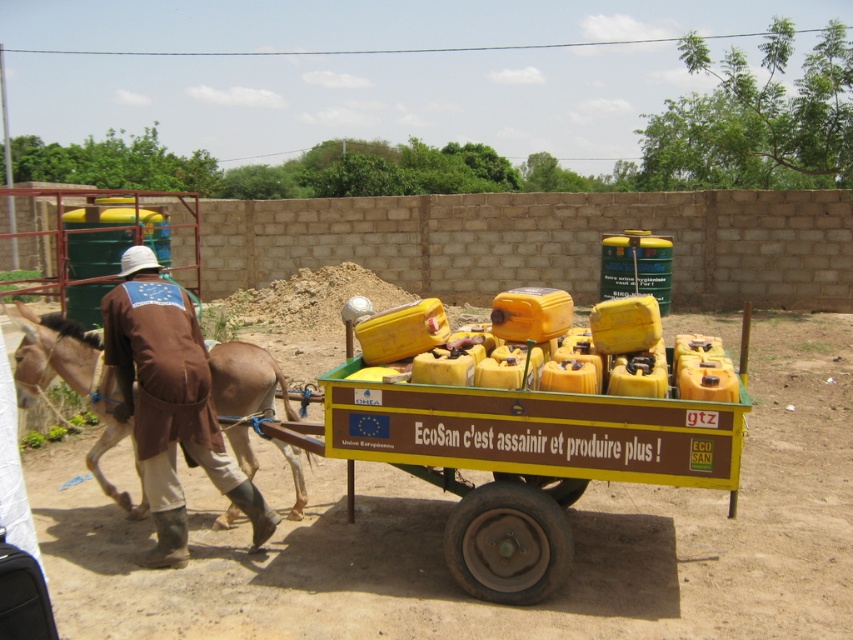
Which is more to the left, brown fabric jacket at left or brown leather mule at left?

From the viewer's perspective, brown leather mule at left appears more on the left side.

Between brown fabric jacket at left and brown leather mule at left, which one has less height?

Standing shorter between the two is brown leather mule at left.

Image resolution: width=853 pixels, height=640 pixels. Identify the location of brown fabric jacket at left. (169, 403).

The height and width of the screenshot is (640, 853). I want to click on brown fabric jacket at left, so click(x=169, y=403).